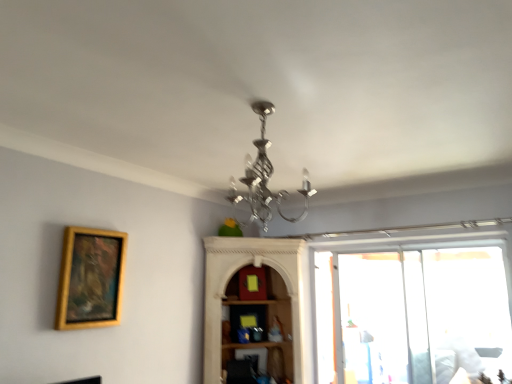
Question: Considering the relative sizes of gold wooden picture frame at left and transparent plastic screen door at right in the image provided, is gold wooden picture frame at left bigger than transparent plastic screen door at right?

Choices:
 (A) no
 (B) yes

Answer: (A)

Question: Is gold wooden picture frame at left placed right next to transparent plastic screen door at right?

Choices:
 (A) no
 (B) yes

Answer: (A)

Question: Is gold wooden picture frame at left facing towards transparent plastic screen door at right?

Choices:
 (A) no
 (B) yes

Answer: (A)

Question: Considering the relative sizes of gold wooden picture frame at left and transparent plastic screen door at right in the image provided, is gold wooden picture frame at left shorter than transparent plastic screen door at right?

Choices:
 (A) yes
 (B) no

Answer: (A)

Question: From a real-world perspective, is gold wooden picture frame at left located higher than transparent plastic screen door at right?

Choices:
 (A) yes
 (B) no

Answer: (A)

Question: Considering the relative positions of gold wooden picture frame at left and transparent plastic screen door at right in the image provided, is gold wooden picture frame at left to the left of transparent plastic screen door at right from the viewer's perspective?

Choices:
 (A) no
 (B) yes

Answer: (B)

Question: Is gold wooden picture frame at left not close to silver metallic chandelier at center?

Choices:
 (A) no
 (B) yes

Answer: (B)

Question: Can you confirm if gold wooden picture frame at left is wider than silver metallic chandelier at center?

Choices:
 (A) no
 (B) yes

Answer: (A)

Question: Considering the relative sizes of gold wooden picture frame at left and silver metallic chandelier at center in the image provided, is gold wooden picture frame at left bigger than silver metallic chandelier at center?

Choices:
 (A) yes
 (B) no

Answer: (B)

Question: Can you confirm if gold wooden picture frame at left is shorter than silver metallic chandelier at center?

Choices:
 (A) yes
 (B) no

Answer: (B)

Question: Is silver metallic chandelier at center a part of gold wooden picture frame at left?

Choices:
 (A) no
 (B) yes

Answer: (A)

Question: From the image's perspective, does gold wooden picture frame at left appear higher than silver metallic chandelier at center?

Choices:
 (A) yes
 (B) no

Answer: (B)

Question: Would you say transparent plastic screen door at right is a long distance from gold wooden picture frame at left?

Choices:
 (A) yes
 (B) no

Answer: (A)